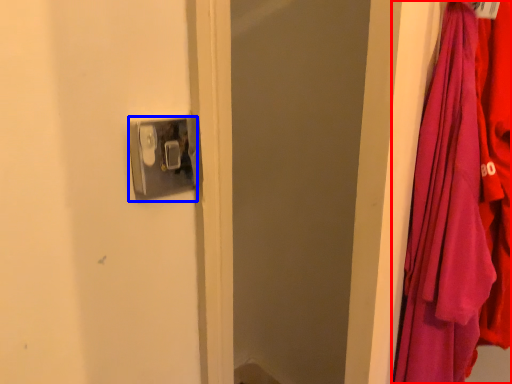
Question: Which point is closer to the camera, curtain (highlighted by a red box) or door handle (highlighted by a blue box)?

Choices:
 (A) curtain
 (B) door handle

Answer: (A)